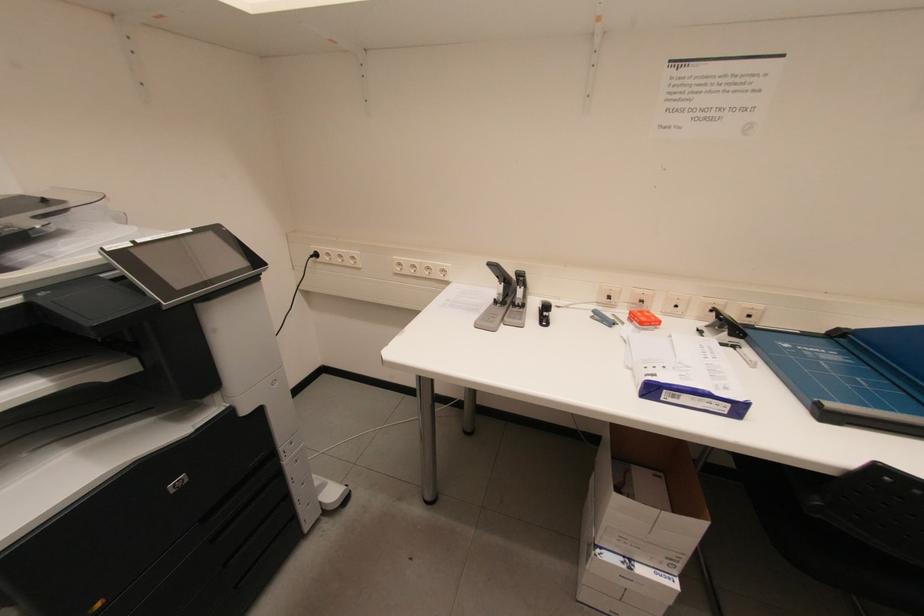
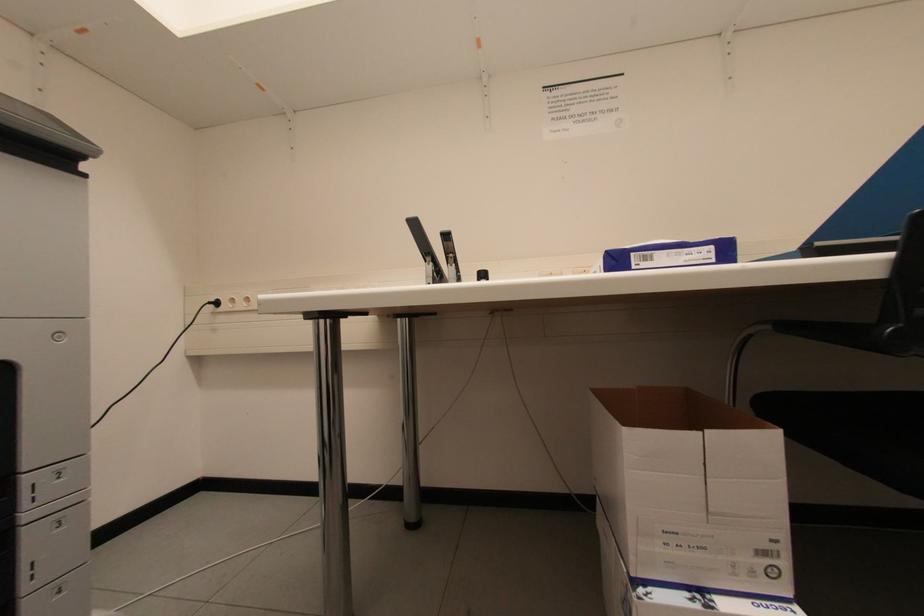
Question: Based on the continuous images, in which direction is the camera rotating? Reply with the corresponding letter.

Choices:
 (A) Left
 (B) Right
 (C) Up
 (D) Down

Answer: (C)